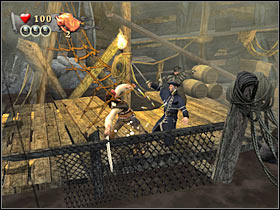
Where is `wood planks`? wood planks is located at coordinates (49, 129), (85, 110), (208, 113).